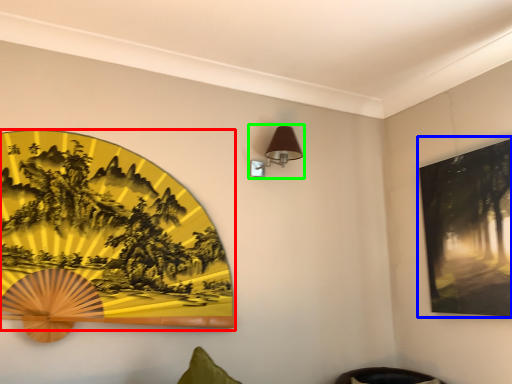
Question: Estimate the real-world distances between objects in this image. Which object is closer to picture frame (highlighted by a red box), picture frame (highlighted by a blue box) or table lamp (highlighted by a green box)?

Choices:
 (A) picture frame
 (B) table lamp

Answer: (B)